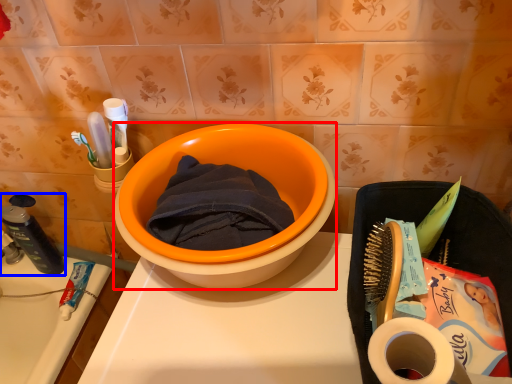
Question: Which object appears closest to the camera in this image, basin (highlighted by a red box) or stationery (highlighted by a blue box)?

Choices:
 (A) basin
 (B) stationery

Answer: (A)